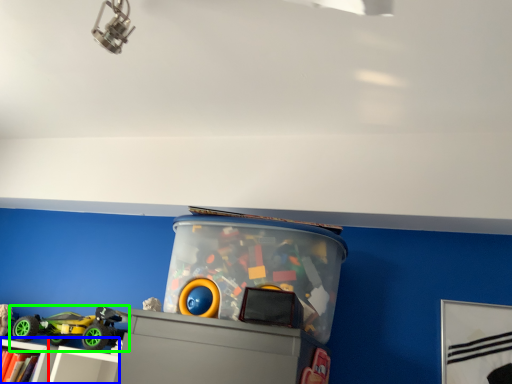
Question: Considering the real-world distances, which object is farthest from bookcase (highlighted by a red box)? shelf (highlighted by a blue box) or toy (highlighted by a green box)?

Choices:
 (A) shelf
 (B) toy

Answer: (B)